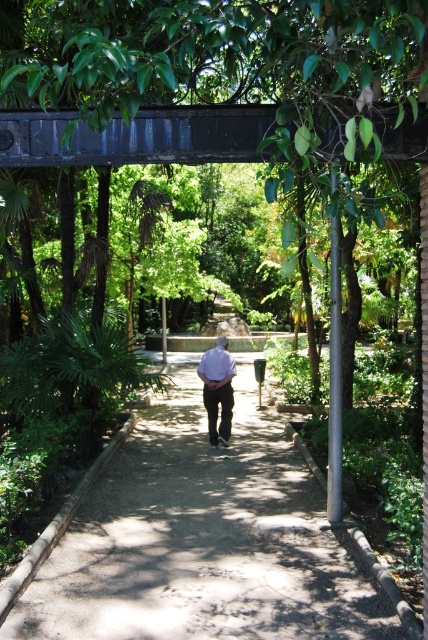
You are a photographer standing in the garden scene. You need to capture a photo that includes both the brown concrete pavement at center and the light purple shirt at center. Which object should you focus on first to ensure both are in the frame?

You should focus on the brown concrete pavement at center first because it is larger than the light purple shirt at center, ensuring it fits within the frame while still capturing the smaller object.

You are standing at the point labeled as point (x=202, y=541) in the garden. What type of surface are you currently standing on?

The point (x=202, y=541) is on brown concrete pavement at center, so you are standing on brown concrete pavement.